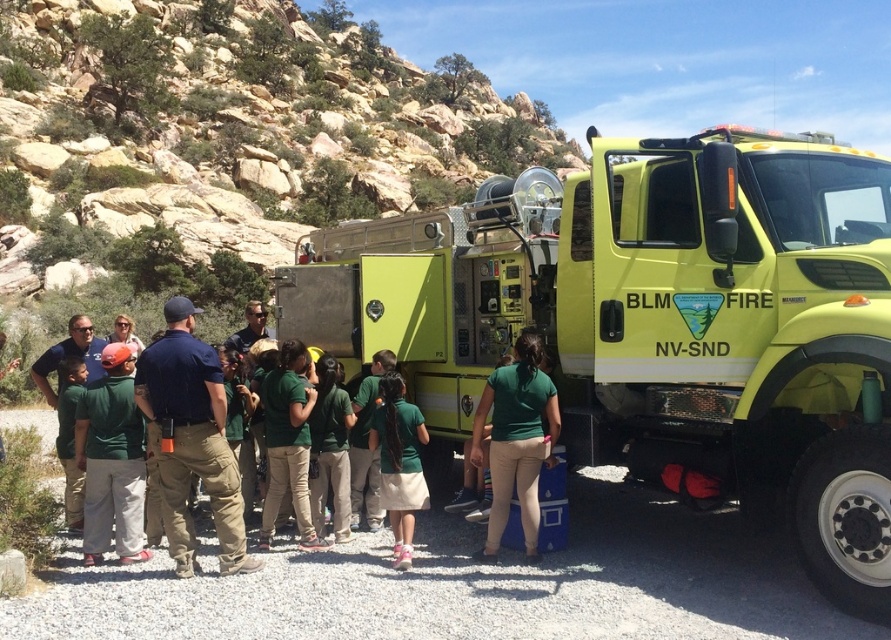
Does matte yellow fire truck at center have a lesser width compared to green fabric shirt at center?

No, matte yellow fire truck at center is not thinner than green fabric shirt at center.

In the scene shown: Who is shorter, matte yellow fire truck at center or green fabric shirt at center?

green fabric shirt at center

Is point (455, 243) positioned before point (394, 496)?

No, (455, 243) is behind (394, 496).

Where is `matte yellow fire truck at center`? matte yellow fire truck at center is located at coordinates (657, 323).

Is the position of green matte shirt at center less distant than that of green fabric shirt at center?

No.

Locate an element on the screen. green matte shirt at center is located at coordinates (515, 440).

The image size is (891, 640). I want to click on green matte shirt at center, so click(515, 440).

Which is behind, point (231, 484) or point (76, 486)?

The point (76, 486) is behind.

Is camo pants at center below green uniform shirt at left?

Actually, camo pants at center is above green uniform shirt at left.

Is point (182, 368) farther from camera compared to point (67, 500)?

No, it is in front of (67, 500).

Find the location of a particular element. The image size is (891, 640). camo pants at center is located at coordinates (191, 440).